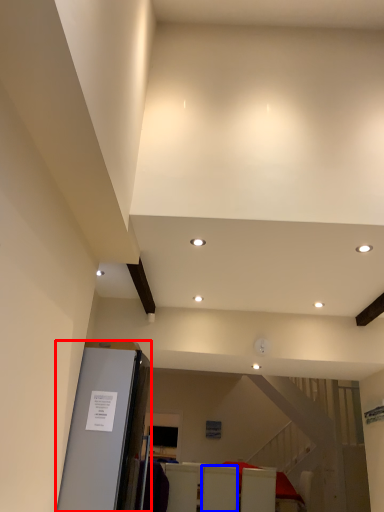
Question: Which point is closer to the camera, elevator (highlighted by a red box) or furniture (highlighted by a blue box)?

Choices:
 (A) elevator
 (B) furniture

Answer: (A)